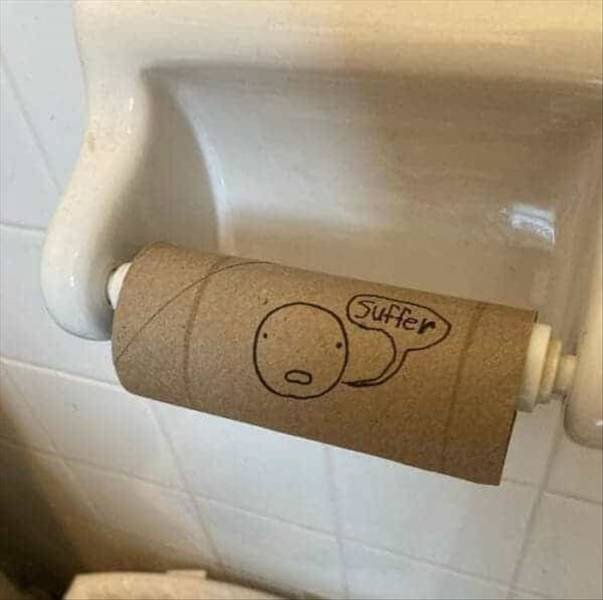
In order to click on tile in this screenshot , I will do `click(232, 500)`.